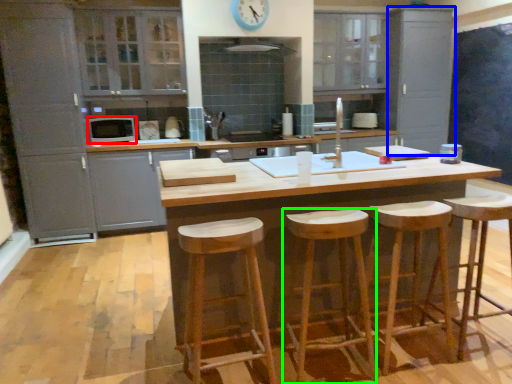
Question: Based on their relative distances, which object is nearer to appliance (highlighted by a red box)? Choose from cabinetry (highlighted by a blue box) and stool (highlighted by a green box).

Choices:
 (A) cabinetry
 (B) stool

Answer: (B)